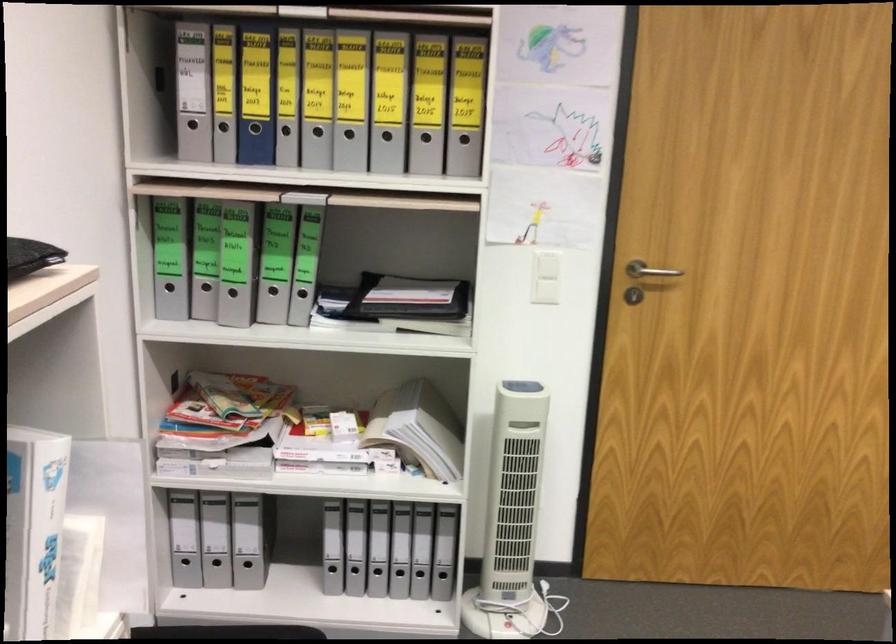
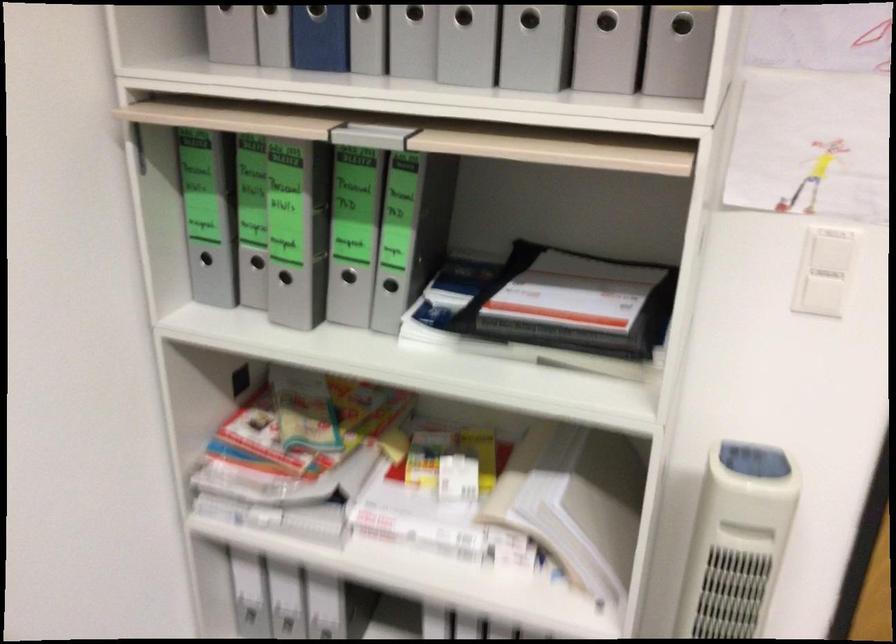
The point at (271, 292) is marked in the first image. Where is the corresponding point in the second image?

(348, 276)